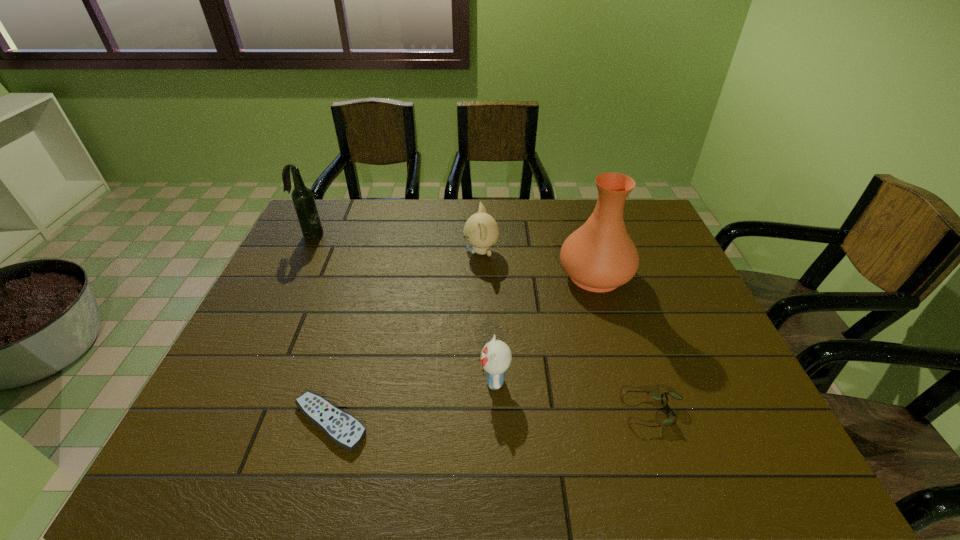
The width and height of the screenshot is (960, 540). I want to click on blank area located on the right of the fifth object from right to left, so click(489, 423).

The image size is (960, 540). What are the coordinates of `beer bottle at the far edge` in the screenshot? It's located at (303, 199).

Locate an element on the screen. kitten positioned at the far edge is located at coordinates (481, 231).

Where is `object that is positioned at the near edge`? The width and height of the screenshot is (960, 540). object that is positioned at the near edge is located at coordinates (342, 428).

At what (x,y) coordinates should I click in order to perform the action: click on object situated at the left edge. Please return your answer as a coordinate pair (x, y). Looking at the image, I should click on (303, 199).

Locate an element on the screen. The image size is (960, 540). object located in the right edge section of the desktop is located at coordinates (600, 256).

The height and width of the screenshot is (540, 960). I want to click on object that is at the far left corner, so click(x=303, y=199).

Locate an element on the screen. The image size is (960, 540). free space at the far edge of the desktop is located at coordinates (439, 220).

Where is `vacant space at the near edge of the desktop`? vacant space at the near edge of the desktop is located at coordinates [621, 466].

Find the location of a particular element. vacant region at the left edge is located at coordinates (314, 269).